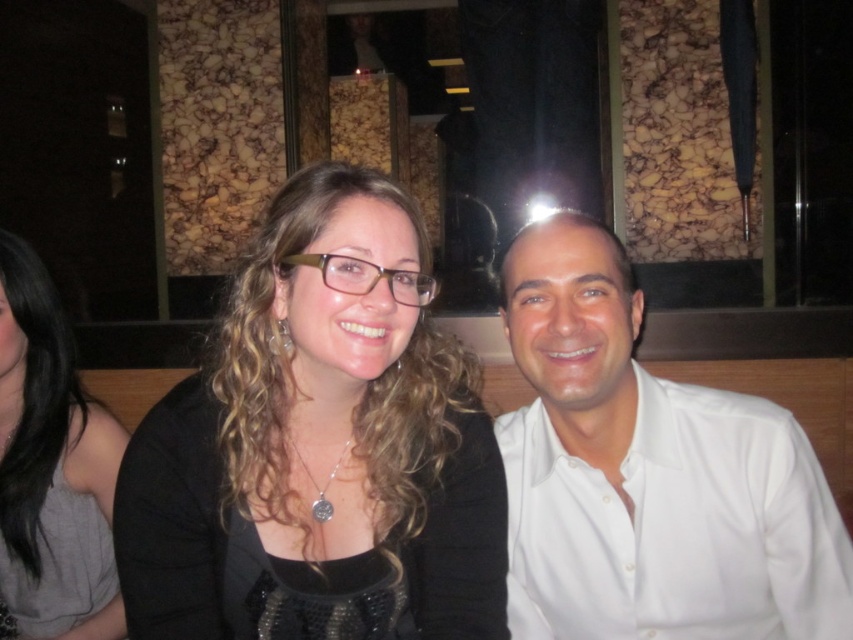
Question: Does black matte hair at center have a smaller size compared to matte black dress at center?

Choices:
 (A) no
 (B) yes

Answer: (A)

Question: Which point appears closest to the camera in this image?

Choices:
 (A) (543, 241)
 (B) (102, 508)

Answer: (A)

Question: Does black matte hair at center appear under white smooth shirt at center?

Choices:
 (A) no
 (B) yes

Answer: (A)

Question: Which object is the closest to the white smooth shirt at center?

Choices:
 (A) matte black dress at center
 (B) black matte hair at center

Answer: (B)

Question: Can you confirm if black matte hair at center is thinner than matte black dress at center?

Choices:
 (A) yes
 (B) no

Answer: (B)

Question: Which of these objects is positioned farthest from the white smooth shirt at center?

Choices:
 (A) matte black dress at center
 (B) black matte hair at center

Answer: (A)